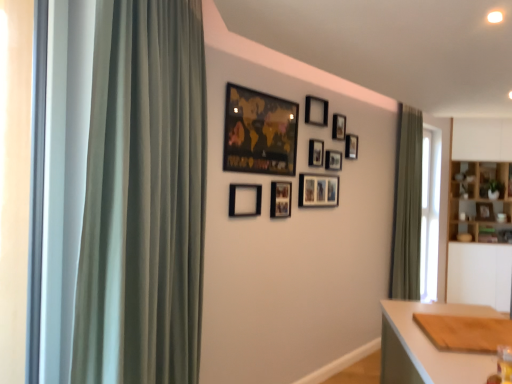
Where is `black matte picture frame at center, the third picture frame when ordered from left to right`? This screenshot has height=384, width=512. black matte picture frame at center, the third picture frame when ordered from left to right is located at coordinates tap(280, 199).

What do you see at coordinates (428, 346) in the screenshot? I see `wooden cutting board at lower right` at bounding box center [428, 346].

What is the approximate height of matte black picture frame at upper center, which is the first picture frame from front to back?

52.70 centimeters.

I want to click on black matte picture frame at upper center, the 5th picture frame viewed from the back, so click(316, 152).

Identify the location of black matte picture frame at upper center, arranged as the 3th picture frame when viewed from the back. This screenshot has width=512, height=384. (339, 127).

The height and width of the screenshot is (384, 512). What are the coordinates of `black matte picture frame at center, marked as the third picture frame in a front-to-back arrangement` in the screenshot? It's located at (280, 199).

Is black matte picture frame at upper center, the 2th picture frame in the right-to-left sequence, facing towards black matte picture frame at upper center, which ranks as the sixth picture frame in right-to-left order?

No, black matte picture frame at upper center, the 2th picture frame in the right-to-left sequence, is not turned towards black matte picture frame at upper center, which ranks as the sixth picture frame in right-to-left order.

From the picture: Considering the sizes of objects black matte picture frame at upper center, which is counted as the second picture frame, starting from the back, and black matte picture frame at upper center, marked as the fifth picture frame in a front-to-back arrangement, in the image provided, who is smaller, black matte picture frame at upper center, which is counted as the second picture frame, starting from the back, or black matte picture frame at upper center, marked as the fifth picture frame in a front-to-back arrangement,?

With smaller size is black matte picture frame at upper center, which is counted as the second picture frame, starting from the back.

From a real-world perspective, which is physically above, black matte picture frame at upper center, which ranks as the 9th picture frame in left-to-right order, or black matte picture frame at upper center, marked as the sixth picture frame in a back-to-front arrangement?

black matte picture frame at upper center, marked as the sixth picture frame in a back-to-front arrangement.

Is black matte picture frame at upper center, arranged as the ninth picture frame when viewed from the front, positioned with its back to wooden cabinet at right?

black matte picture frame at upper center, arranged as the ninth picture frame when viewed from the front, is not turned away from wooden cabinet at right.

What are the coordinates of `cabinetry behind the black matte picture frame at upper center, which is counted as the second picture frame, starting from the back` in the screenshot? It's located at (480, 202).

Would you say black matte picture frame at upper center, the 2th picture frame in the right-to-left sequence, contains wooden cabinet at right?

No, wooden cabinet at right is not surrounded by black matte picture frame at upper center, the 2th picture frame in the right-to-left sequence.

Is point (306, 113) closer or farther from the camera than point (336, 124)?

Point (306, 113).

From a real-world perspective, is black matte picture frame at upper center, marked as the sixth picture frame in a back-to-front arrangement, physically located above or below black matte picture frame at upper center, positioned as the eighth picture frame in left-to-right order?

black matte picture frame at upper center, marked as the sixth picture frame in a back-to-front arrangement, is above black matte picture frame at upper center, positioned as the eighth picture frame in left-to-right order.

Considering the relative positions of black matte picture frame at upper center, marked as the fifth picture frame in a front-to-back arrangement, and black matte picture frame at upper center, arranged as the 3th picture frame when viewed from the back, in the image provided, is black matte picture frame at upper center, marked as the fifth picture frame in a front-to-back arrangement, behind black matte picture frame at upper center, arranged as the 3th picture frame when viewed from the back,?

That is False.

Consider the image. From the image's perspective, which is below, black matte picture frame at upper center, marked as the fifth picture frame in a front-to-back arrangement, or black matte picture frame at upper center, placed as the 3th picture frame when sorted from right to left?

From the image's view, black matte picture frame at upper center, placed as the 3th picture frame when sorted from right to left, is below.

Is black matte picture frame at center, the third picture frame when ordered from left to right, smaller than wooden picture frame at center, positioned as the first picture frame in back-to-front order?

Yes.

From a real-world perspective, which is physically above, black matte picture frame at center, marked as the third picture frame in a front-to-back arrangement, or wooden picture frame at center, which is the tenth picture frame in left-to-right order?

From a 3D spatial view, black matte picture frame at center, marked as the third picture frame in a front-to-back arrangement, is above.

Is black matte picture frame at center, the eighth picture frame viewed from the right, facing towards wooden picture frame at center, placed as the 1th picture frame when sorted from right to left?

No, black matte picture frame at center, the eighth picture frame viewed from the right, is not aimed at wooden picture frame at center, placed as the 1th picture frame when sorted from right to left.

How distant is black matte picture frame at center, the third picture frame when ordered from left to right, from wooden picture frame at center, positioned as the first picture frame in back-to-front order?

3.43 meters.

Choose the correct answer: Is matte black picture frame at upper center, placed as the 9th picture frame when sorted from right to left, inside black matte picture frame at upper center, which ranks as the 9th picture frame in left-to-right order, or outside it?

The correct answer is: outside.

From a real-world perspective, is matte black picture frame at upper center, which is the first picture frame from front to back, positioned over black matte picture frame at upper center, the 2th picture frame in the right-to-left sequence, based on gravity?

No, from a real-world perspective, matte black picture frame at upper center, which is the first picture frame from front to back, is not above black matte picture frame at upper center, the 2th picture frame in the right-to-left sequence.

Which of these two, matte black picture frame at upper center, which is the first picture frame from front to back, or black matte picture frame at upper center, which ranks as the 9th picture frame in left-to-right order, is smaller?

black matte picture frame at upper center, which ranks as the 9th picture frame in left-to-right order, is smaller.

Between wooden cutting board at lower right and black matte picture frame at upper center, the 2th picture frame in the right-to-left sequence, which one has larger width?

A: Wider between the two is wooden cutting board at lower right.

Considering the positions of point (470, 359) and point (345, 148), is point (470, 359) closer or farther from the camera than point (345, 148)?

Point (470, 359) is closer to the camera than point (345, 148).

From a real-world perspective, is wooden cutting board at lower right beneath black matte picture frame at upper center, the 2th picture frame in the right-to-left sequence?

Correct, in the physical world, wooden cutting board at lower right is lower than black matte picture frame at upper center, the 2th picture frame in the right-to-left sequence.

Is the depth of wooden cutting board at lower right less than that of black matte picture frame at upper center, the 2th picture frame in the right-to-left sequence?

Yes, wooden cutting board at lower right is closer to the camera.

Does matte black picture frame at upper center, which is the first picture frame from front to back, appear on the right side of wooden cutting board at lower right?

In fact, matte black picture frame at upper center, which is the first picture frame from front to back, is to the left of wooden cutting board at lower right.

Which object is wider, matte black picture frame at upper center, the second picture frame from the left, or wooden cutting board at lower right?

wooden cutting board at lower right.

Consider the image. Is matte black picture frame at upper center, which is the first picture frame from front to back, in front of or behind wooden cutting board at lower right in the image?

matte black picture frame at upper center, which is the first picture frame from front to back, is positioned farther from the viewer than wooden cutting board at lower right.

Image resolution: width=512 pixels, height=384 pixels. Identify the location of picture frame that is the 2nd one when counting upward from the black matte picture frame at upper center, the 2th picture frame in the right-to-left sequence (from the image's perspective). (316, 111).

From the wooden cabinet at right, count 1st picture frames forward and point to it. Please provide its 2D coordinates.

[(351, 146)]

From the picture: Estimate the real-world distances between objects in this image. Which object is further from black matte picture frame at upper center, positioned as the eighth picture frame in left-to-right order, matte black picture frame at upper center, which appears as the tenth picture frame when viewed from the back, or black matte picture frame at upper center, the 5th picture frame viewed from the back?

matte black picture frame at upper center, which appears as the tenth picture frame when viewed from the back, lies further to black matte picture frame at upper center, positioned as the eighth picture frame in left-to-right order, than the other object.

Estimate the real-world distances between objects in this image. Which object is further from matte black picture frame at upper center, which is the first picture frame from front to back, wooden cabinet at right or wooden cutting board at lower right?

The object further to matte black picture frame at upper center, which is the first picture frame from front to back, is wooden cabinet at right.

Based on their spatial positions, is wooden cabinet at right or black matte picture frame at upper center, the 5th picture frame viewed from the back, closer to black matte picture frame at upper center, arranged as the ninth picture frame when viewed from the front?

The object closer to black matte picture frame at upper center, arranged as the ninth picture frame when viewed from the front, is black matte picture frame at upper center, the 5th picture frame viewed from the back.

When comparing their distances from black matte picture frame at upper center, which is the fifth picture frame in left-to-right order, does wooden cabinet at right or matte black picture frame at center, arranged as the fifth picture frame when viewed from the right, seem further?

wooden cabinet at right lies further to black matte picture frame at upper center, which is the fifth picture frame in left-to-right order, than the other object.

From the image, which object appears to be farther from matte black picture frame at upper center, placed as the 9th picture frame when sorted from right to left, wooden picture frame at center, positioned as the first picture frame in back-to-front order, or black matte picture frame at upper center, arranged as the ninth picture frame when viewed from the front?

wooden picture frame at center, positioned as the first picture frame in back-to-front order.

Considering their positions, is black matte picture frame at upper center, which is the 7th picture frame from left to right, positioned closer to black matte picture frame at upper center, which ranks as the 9th picture frame in left-to-right order, than black matte picture frame at upper center, arranged as the 7th picture frame when viewed from the right?

The object closer to black matte picture frame at upper center, which ranks as the 9th picture frame in left-to-right order, is black matte picture frame at upper center, which is the 7th picture frame from left to right.

Based on their spatial positions, is black matte picture frame at center, the third picture frame when ordered from left to right, or wooden cutting board at lower right closer to green fabric curtain at right, arranged as the first curtain when viewed from the right?

black matte picture frame at center, the third picture frame when ordered from left to right, is closer to green fabric curtain at right, arranged as the first curtain when viewed from the right.

When comparing their distances from black matte picture frame at upper center, placed as the 3th picture frame when sorted from right to left, does wooden cutting board at lower right or black matte picture frame at center, placed as the ninth picture frame when sorted from back to front, seem further?

wooden cutting board at lower right is positioned further to the anchor black matte picture frame at upper center, placed as the 3th picture frame when sorted from right to left.

Locate an element on the screen. curtain between black matte picture frame at upper center, marked as the fifth picture frame in a front-to-back arrangement, and wooden cabinet at right is located at coordinates (407, 207).

Identify the location of picture frame between black matte picture frame at upper center, arranged as the 3th picture frame when viewed from the back, and wooden cabinet at right. (351, 146).

Identify the location of table located between green fabric curtain at left, placed as the second curtain when sorted from back to front, and black matte picture frame at upper center, the 4th picture frame when ordered from back to front, in the depth direction. (428, 346).

Locate an element on the screen. This screenshot has height=384, width=512. cabinetry situated between black matte picture frame at upper center, which ranks as the sixth picture frame in right-to-left order, and wooden picture frame at center, which is the tenth picture frame in front-to-back order, from left to right is located at coordinates (480, 202).